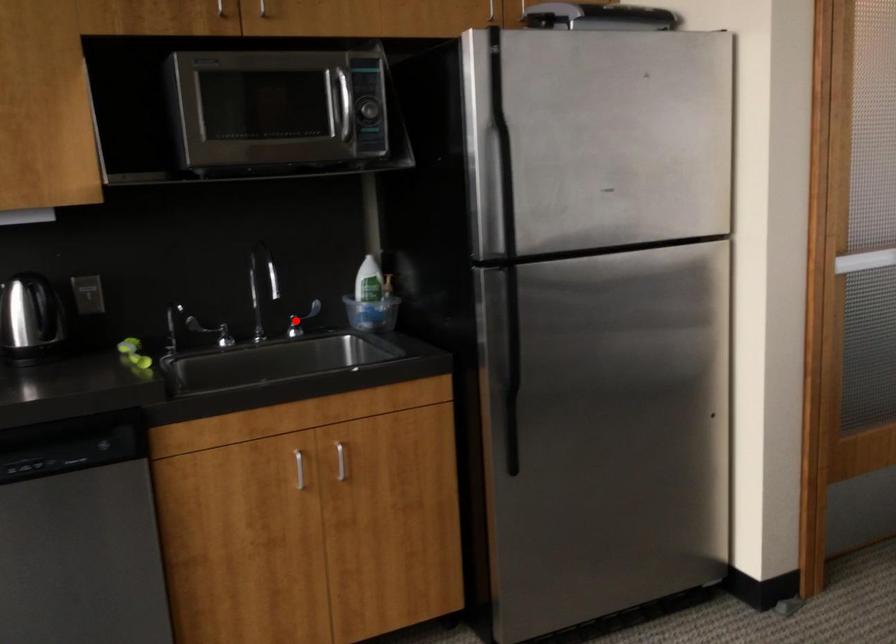
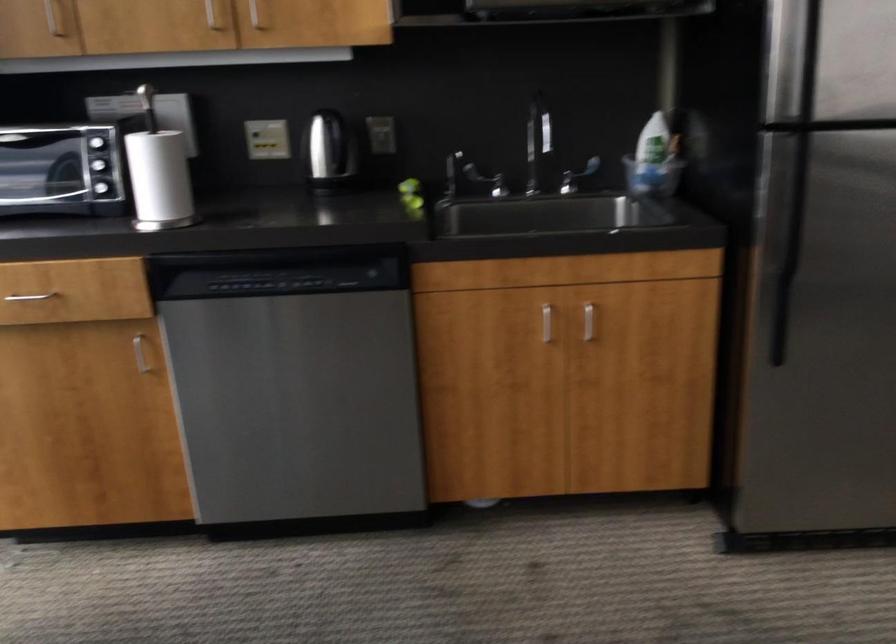
In the second image, find the point that corresponds to the highlighted location in the first image.

(576, 176)